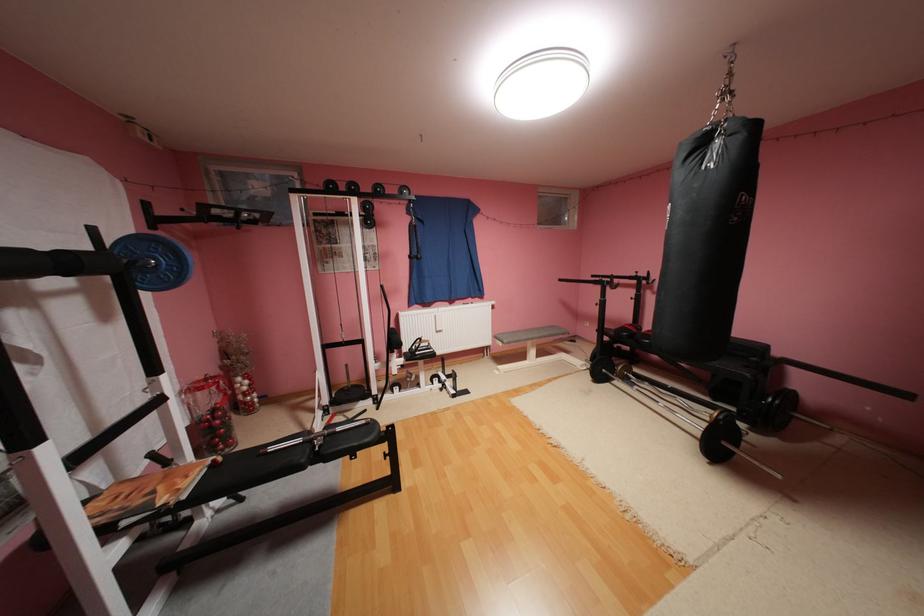
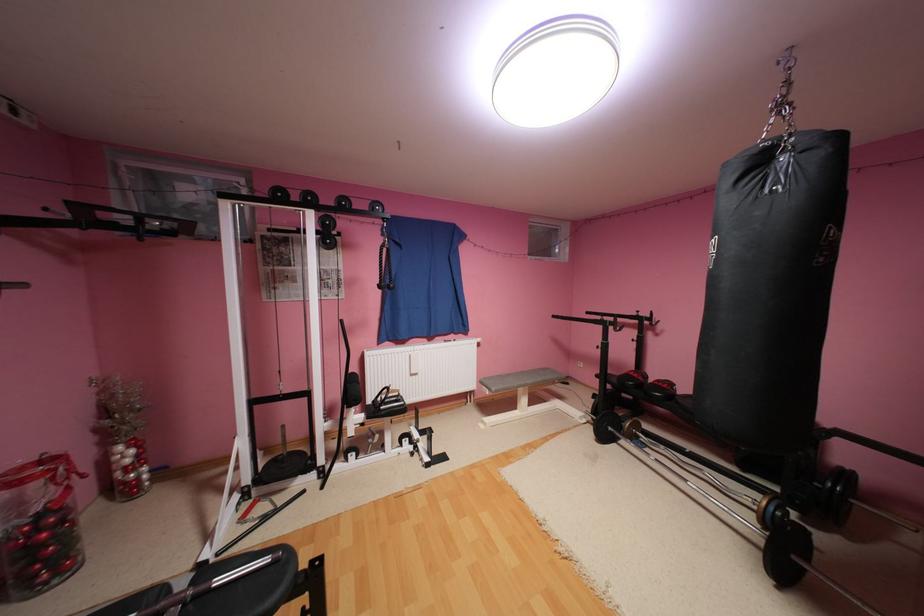
Question: I am providing you with two images of the same scene from different viewpoints. Please identify which objects are invisible in image2.

Choices:
 (A) black row handle
 (B) white radiator knob
 (C) black weight plate
 (D) none of these

Answer: (D)